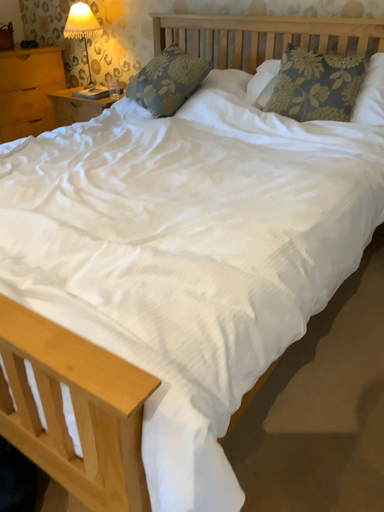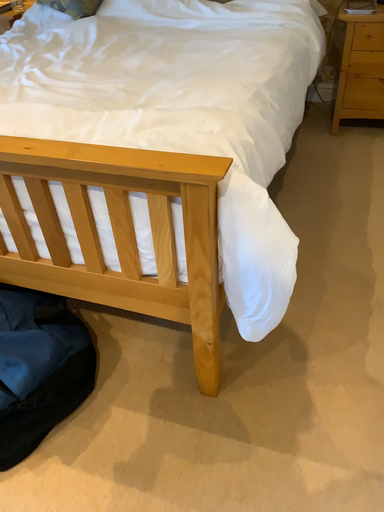
Question: How did the camera likely rotate when shooting the video?

Choices:
 (A) rotated upward
 (B) rotated downward

Answer: (B)